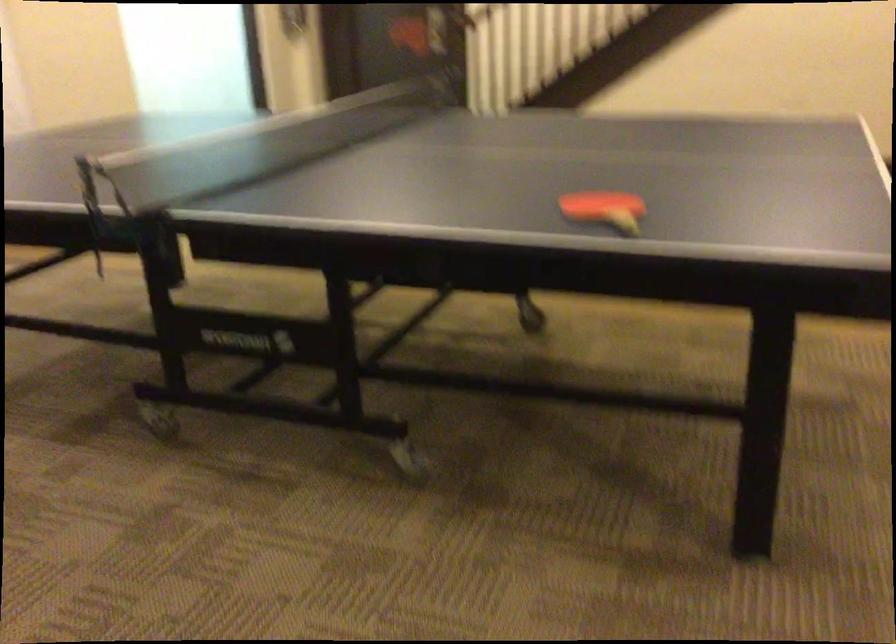
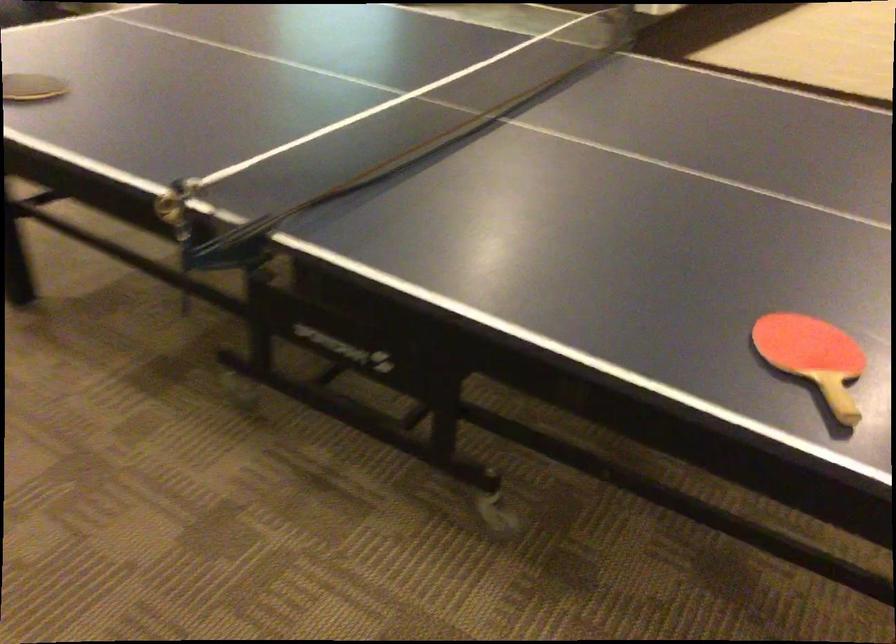
Where in the second image is the point corresponding to pixel 82 184 from the first image?

(174, 207)